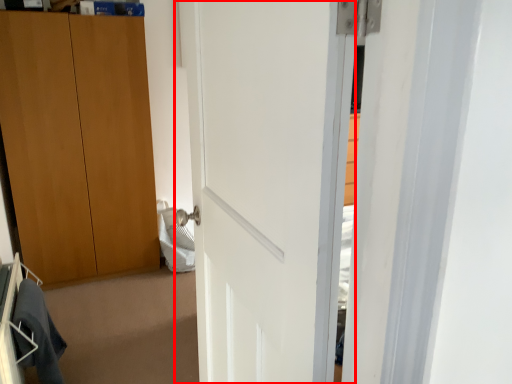
Question: Considering the relative positions of door (annotated by the red box) and robe in the image provided, where is door (annotated by the red box) located with respect to the staircase?

Choices:
 (A) left
 (B) right

Answer: (B)